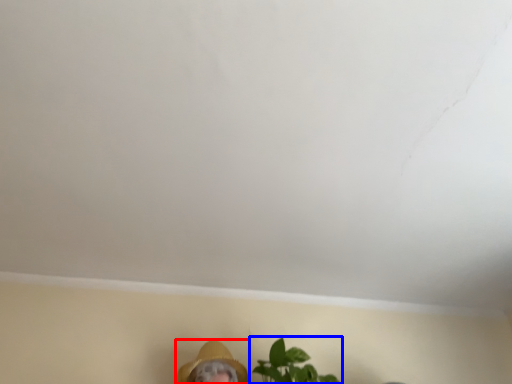
Question: Among these objects, which one is farthest to the camera, person (highlighted by a red box) or houseplant (highlighted by a blue box)?

Choices:
 (A) person
 (B) houseplant

Answer: (A)